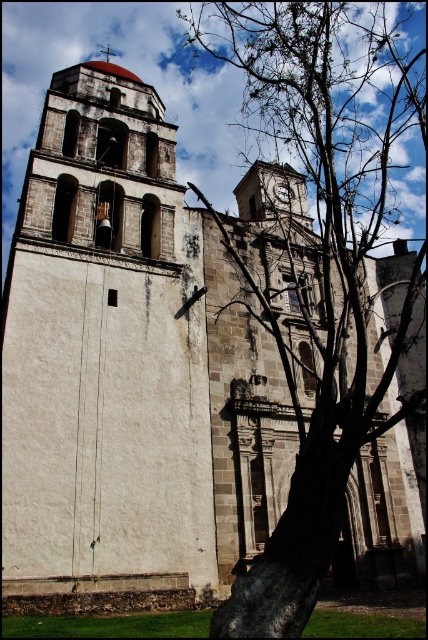
You are standing in front of the historic stone church and notice a brown bark tree at center and a metallic clock at center. From your perspective, which object is positioned to the right of the other?

The brown bark tree at center is to the right of the metallic clock at center.

You are standing in front of the historic stone church and notice a brown bark tree at center and a metallic clock at center. Which object is closer to you?

The brown bark tree at center is closer to you as it is positioned in front of the metallic clock at center.